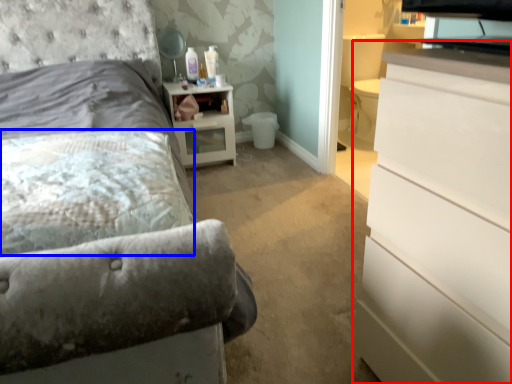
Question: Among these objects, which one is farthest to the camera, chest of drawers (highlighted by a red box) or pillow (highlighted by a blue box)?

Choices:
 (A) chest of drawers
 (B) pillow

Answer: (B)